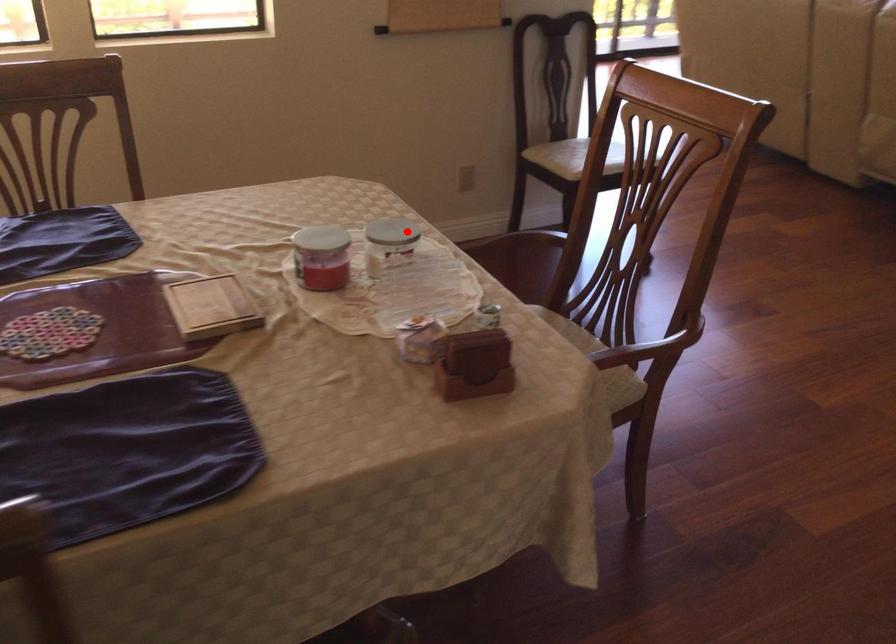
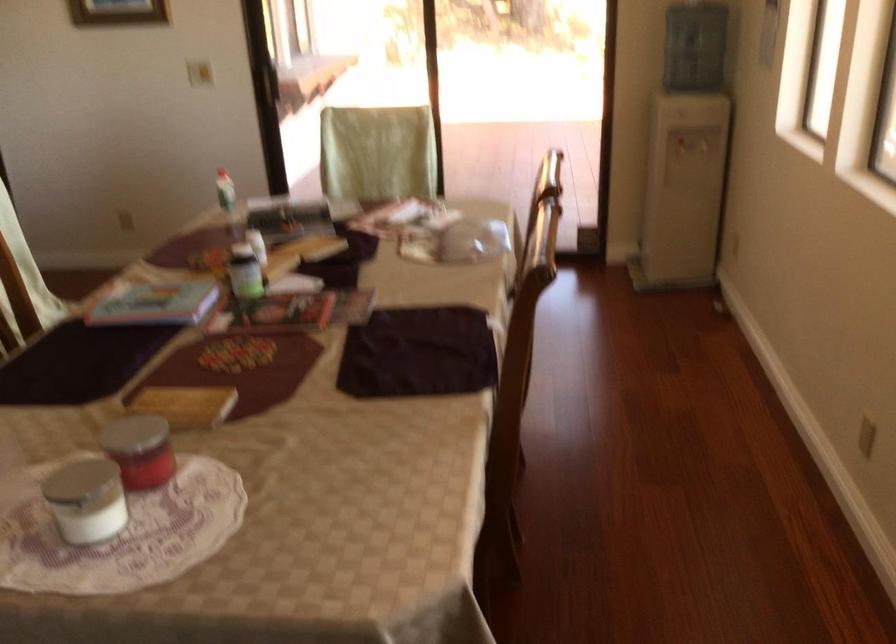
Question: I am providing you with two images of the same scene from different viewpoints. Image1 has a red point marked. In image2, the corresponding 3D location appears at what relative position? Reply with the corresponding letter.

Choices:
 (A) Closer
 (B) Farther

Answer: (A)